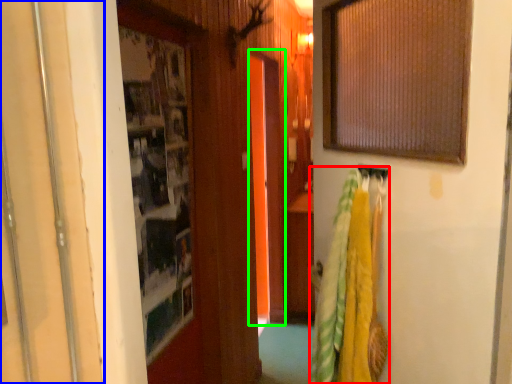
Question: Which object is positioned farthest from laundry (highlighted by a red box)? Select from door (highlighted by a blue box) and screen door (highlighted by a green box).

Choices:
 (A) door
 (B) screen door

Answer: (B)